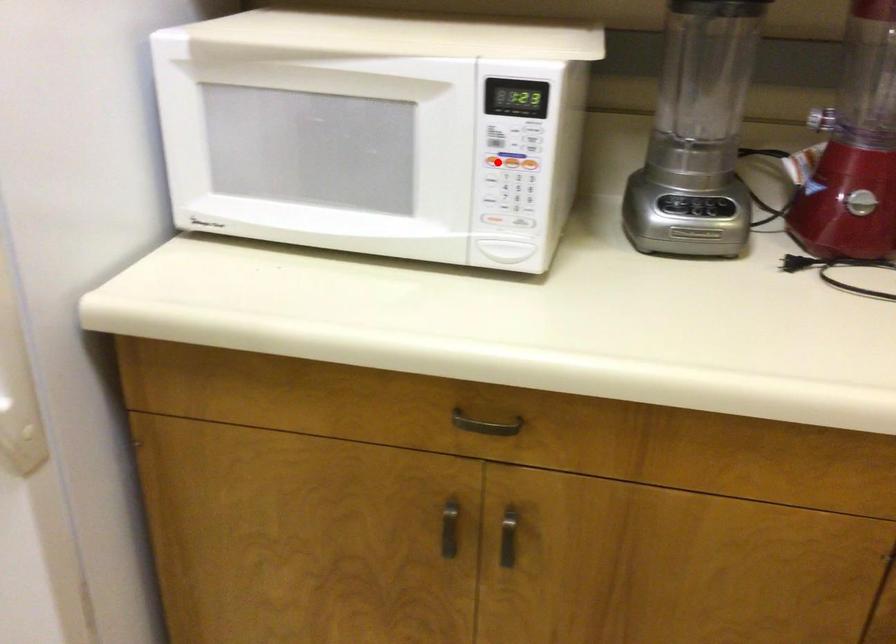
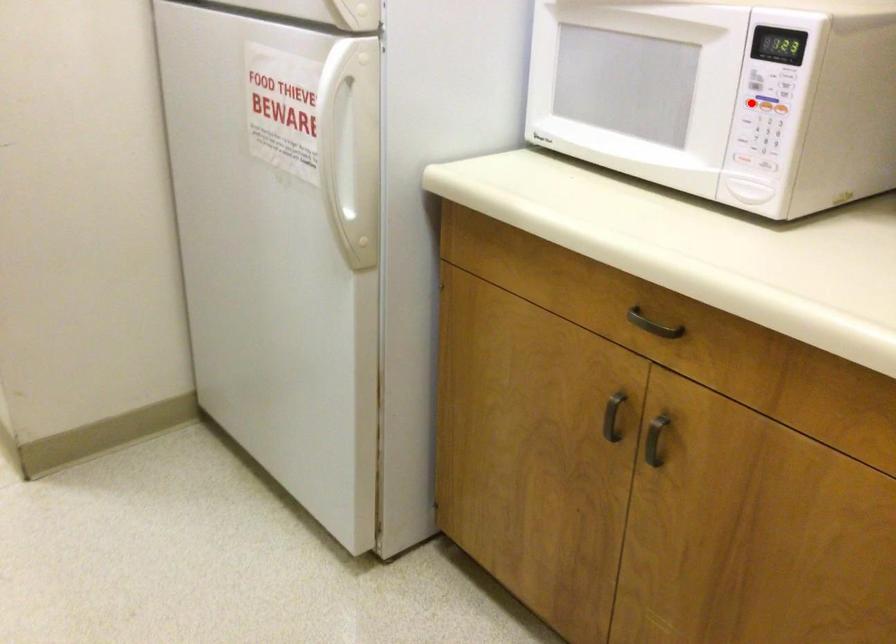
I am providing you with two images of the same scene from different viewpoints. A red point is marked on the first image and another point is marked on the second image. Is the red point in image1 aligned with the point shown in image2?

Yes